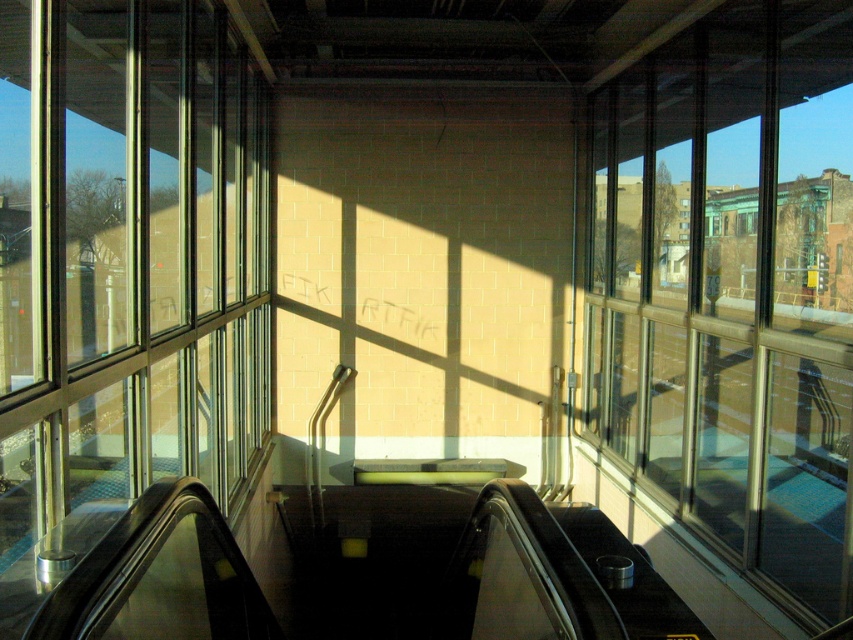
Does transparent glass window at right appear over transparent glass windows at left?

Indeed, transparent glass window at right is positioned over transparent glass windows at left.

Does transparent glass window at right come behind transparent glass windows at left?

No, transparent glass window at right is in front of transparent glass windows at left.

Who is more forward, (605, 308) or (61, 259)?

Point (61, 259) is in front.

Identify the location of transparent glass window at right. Image resolution: width=853 pixels, height=640 pixels. (730, 294).